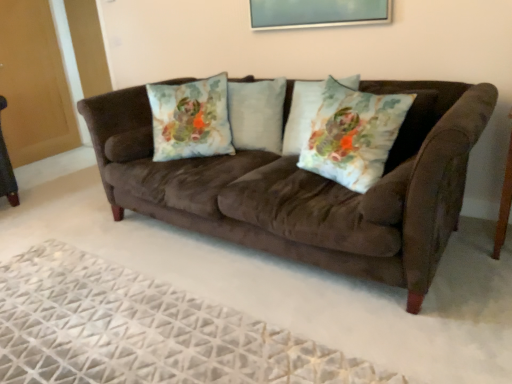
Question: Which direction should I rotate to look at floral fabric pillow at center, positioned as the 2th throw pillow in right-to-left order, — up or down?

Choices:
 (A) down
 (B) up

Answer: (B)

Question: Considering the relative sizes of floral fabric pillow at center, marked as the first throw pillow in a right-to-left arrangement, and light blue fabric pillow at center, which is the first pillow in right-to-left order, in the image provided, is floral fabric pillow at center, marked as the first throw pillow in a right-to-left arrangement, wider than light blue fabric pillow at center, which is the first pillow in right-to-left order,?

Choices:
 (A) yes
 (B) no

Answer: (A)

Question: Considering the relative positions of floral fabric pillow at center, which ranks as the second throw pillow in left-to-right order, and light blue fabric pillow at center, which is the first pillow in right-to-left order, in the image provided, is floral fabric pillow at center, which ranks as the second throw pillow in left-to-right order, to the left of light blue fabric pillow at center, which is the first pillow in right-to-left order, from the viewer's perspective?

Choices:
 (A) no
 (B) yes

Answer: (A)

Question: Is floral fabric pillow at center, which ranks as the second throw pillow in left-to-right order, directly adjacent to light blue fabric pillow at center, positioned as the second pillow in left-to-right order?

Choices:
 (A) yes
 (B) no

Answer: (B)

Question: Is floral fabric pillow at center, positioned as the 1th throw pillow in front-to-back order, not inside light blue fabric pillow at center, which is the first pillow in right-to-left order?

Choices:
 (A) no
 (B) yes

Answer: (B)

Question: Does floral fabric pillow at center, which ranks as the second throw pillow in left-to-right order, appear on the right side of light blue fabric pillow at center, which is the first pillow in right-to-left order?

Choices:
 (A) yes
 (B) no

Answer: (A)

Question: From the image's perspective, does floral fabric pillow at center, marked as the first throw pillow in a right-to-left arrangement, appear higher than light blue fabric pillow at center, positioned as the second pillow in left-to-right order?

Choices:
 (A) no
 (B) yes

Answer: (A)

Question: Is light blue fabric pillow at center, positioned as the second pillow in left-to-right order, at the right side of brown wood side table at right?

Choices:
 (A) no
 (B) yes

Answer: (A)

Question: Can you confirm if light blue fabric pillow at center, positioned as the second pillow in left-to-right order, is positioned to the left of brown wood side table at right?

Choices:
 (A) no
 (B) yes

Answer: (B)

Question: Are light blue fabric pillow at center, which is the first pillow in right-to-left order, and brown wood side table at right far apart?

Choices:
 (A) yes
 (B) no

Answer: (A)

Question: From a real-world perspective, is light blue fabric pillow at center, positioned as the second pillow in left-to-right order, over brown wood side table at right?

Choices:
 (A) yes
 (B) no

Answer: (A)

Question: Can you confirm if light blue fabric pillow at center, positioned as the second pillow in left-to-right order, is bigger than brown wood side table at right?

Choices:
 (A) no
 (B) yes

Answer: (B)

Question: Is the position of light blue fabric pillow at center, which is the first pillow in right-to-left order, more distant than that of brown wood side table at right?

Choices:
 (A) no
 (B) yes

Answer: (B)

Question: From the image's perspective, is fluffy white pillow at center, arranged as the 2th pillow when viewed from the right, under suede couch at center?

Choices:
 (A) yes
 (B) no

Answer: (B)